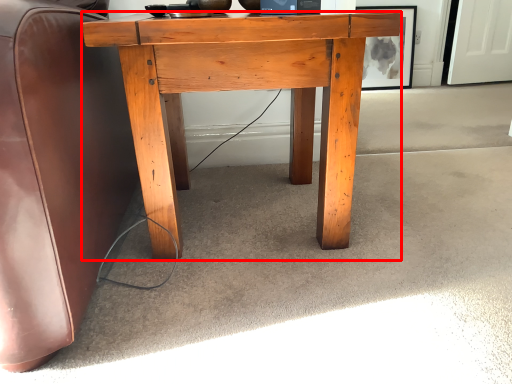
Question: From the image, what is the correct spatial relationship of desk (annotated by the red box) in relation to picture frame?

Choices:
 (A) right
 (B) left

Answer: (B)